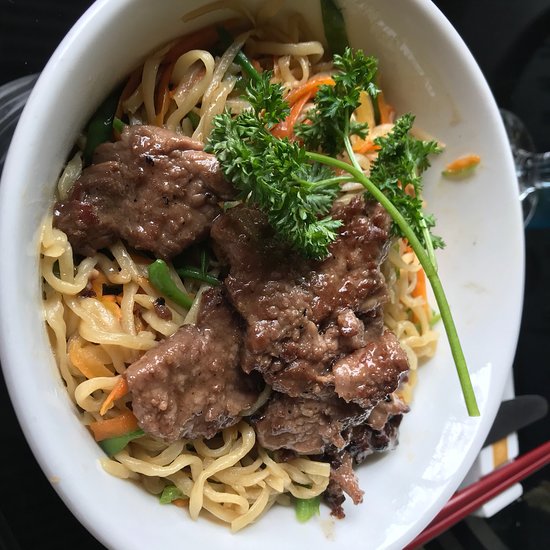
The image size is (550, 550). I want to click on bowl, so click(x=481, y=235), click(x=41, y=405).